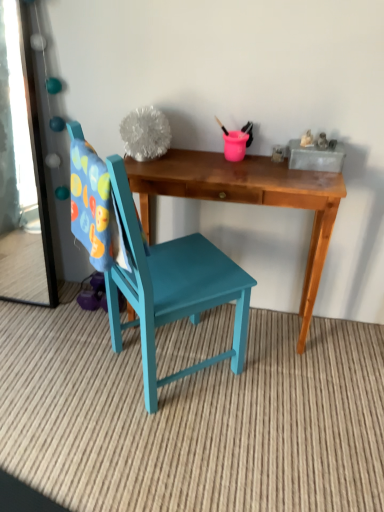
Question: Is teal painted wood chair at center outside of clear glass mirror at left?

Choices:
 (A) yes
 (B) no

Answer: (A)

Question: Are teal painted wood chair at center and clear glass mirror at left far apart?

Choices:
 (A) yes
 (B) no

Answer: (B)

Question: Is teal painted wood chair at center at the left side of clear glass mirror at left?

Choices:
 (A) yes
 (B) no

Answer: (B)

Question: Is teal painted wood chair at center shorter than clear glass mirror at left?

Choices:
 (A) yes
 (B) no

Answer: (B)

Question: Does teal painted wood chair at center appear on the right side of clear glass mirror at left?

Choices:
 (A) yes
 (B) no

Answer: (A)

Question: From the image's perspective, is teal painted wood chair at center located beneath clear glass mirror at left?

Choices:
 (A) yes
 (B) no

Answer: (A)

Question: Can you confirm if wooden desk at center is bigger than clear glass mirror at left?

Choices:
 (A) yes
 (B) no

Answer: (A)

Question: Is wooden desk at center closer to camera compared to clear glass mirror at left?

Choices:
 (A) yes
 (B) no

Answer: (A)

Question: Is wooden desk at center oriented towards clear glass mirror at left?

Choices:
 (A) no
 (B) yes

Answer: (A)

Question: Does wooden desk at center have a smaller size compared to clear glass mirror at left?

Choices:
 (A) yes
 (B) no

Answer: (B)

Question: From the image's perspective, is wooden desk at center over clear glass mirror at left?

Choices:
 (A) no
 (B) yes

Answer: (A)

Question: Can you see wooden desk at center touching clear glass mirror at left?

Choices:
 (A) yes
 (B) no

Answer: (B)

Question: Is clear glass mirror at left to the right of teal painted wood chair at center from the viewer's perspective?

Choices:
 (A) no
 (B) yes

Answer: (A)